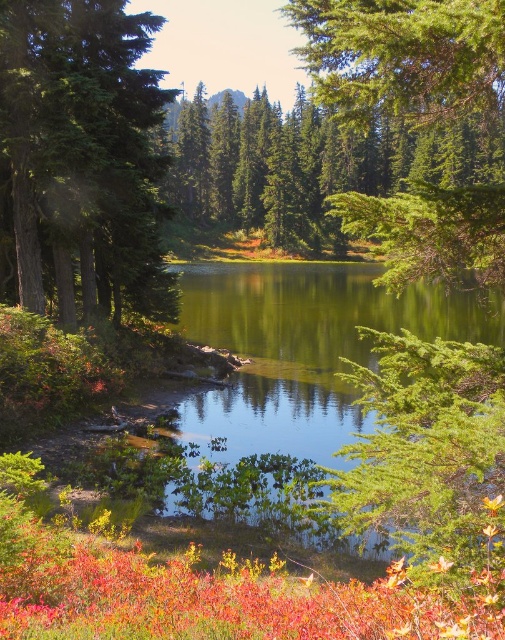
Based on the photo, you are standing at the edge of the lake and want to take a photo of the green matte tree at left and the green reflective water at center. Which object will appear larger in the photo?

The green reflective water at center will appear larger in the photo because it is larger than the green matte tree at left.

You are an artist planning to paint the scene. You want to ensure the green matte tree at left and the green textured tree at upper right are proportionally accurate. Which tree should you paint smaller?

The green matte tree at left should be painted smaller since it has a smaller size compared to the green textured tree at upper right.

You are an artist planning to paint the scene. You want to ensure the green reflective water at center and the green textured tree at upper right are proportionally accurate. Which object should you paint first to maintain the correct size relationship?

You should paint the green textured tree at upper right first because it occupies more space than the green reflective water at center, ensuring proper scaling before detailing the smaller area.